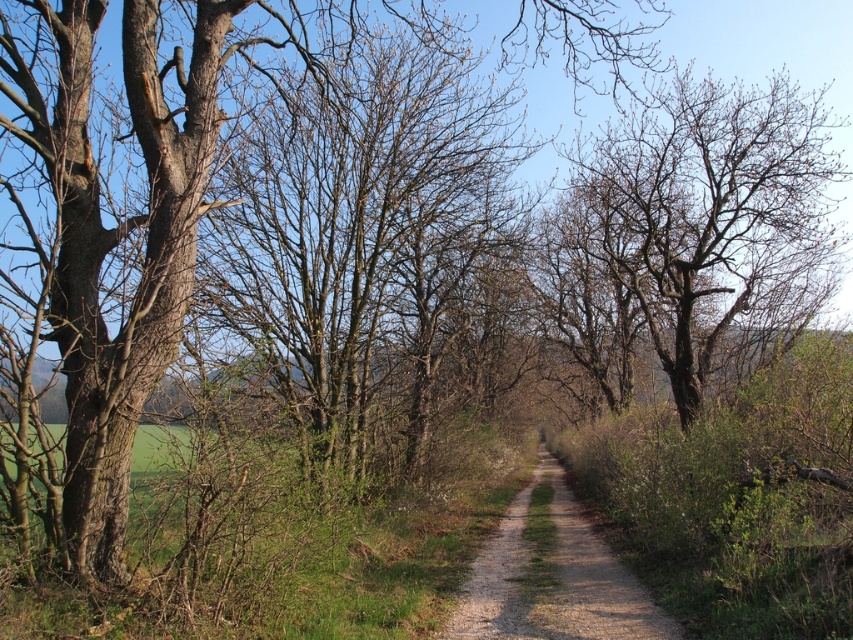
Between brown bark tree at center and bare brown tree at center, which one has more height?

brown bark tree at center is taller.

Does brown bark tree at center appear on the right side of bare brown tree at center?

No, brown bark tree at center is not to the right of bare brown tree at center.

Measure the distance between brown bark tree at center and camera.

18.38 feet

The height and width of the screenshot is (640, 853). Identify the location of brown bark tree at center. click(106, 234).

Does bare brown tree at center have a lesser height compared to dirt/gravel path at center?

No, bare brown tree at center is not shorter than dirt/gravel path at center.

Between bare brown tree at center and dirt/gravel path at center, which one appears on the left side from the viewer's perspective?

dirt/gravel path at center

Measure the distance between bare brown tree at center and camera.

bare brown tree at center and camera are 37.90 feet apart.

You are a GUI agent. You are given a task and a screenshot of the screen. Output one action in this format:
    pyautogui.click(x=<x>, y=<y>)
    Task: Click on the bare brown tree at center
    This screenshot has width=853, height=640.
    Given the screenshot: What is the action you would take?
    (712, 221)

Who is positioned more to the left, brown bark tree at center or dirt/gravel path at center?

brown bark tree at center is more to the left.

Can you confirm if brown bark tree at center is taller than dirt/gravel path at center?

Correct, brown bark tree at center is much taller as dirt/gravel path at center.

Where is `brown bark tree at center`? brown bark tree at center is located at coordinates pos(106,234).

Identify the location of brown bark tree at center. (106, 234).